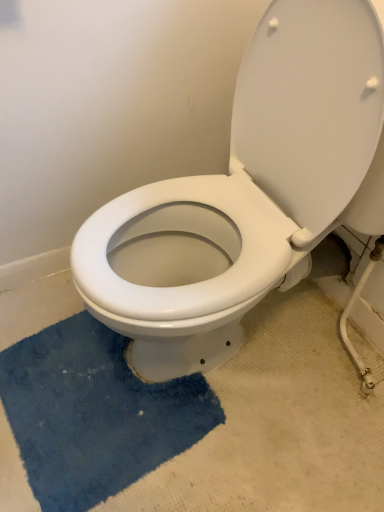
You are a GUI agent. You are given a task and a screenshot of the screen. Output one action in this format:
    pyautogui.click(x=<x>, y=<y>)
    Task: Click on the white glossy toilet at center
    The image size is (384, 512).
    Given the screenshot: What is the action you would take?
    click(x=247, y=194)

What do you see at coordinates (247, 194) in the screenshot? I see `white glossy toilet at center` at bounding box center [247, 194].

Locate an element on the screen. blue plush bath mat at lower left is located at coordinates (94, 413).

Measure the distance between point [104,416] and camera.

Point [104,416] is 1.02 meters from camera.

What do you see at coordinates (94, 413) in the screenshot?
I see `blue plush bath mat at lower left` at bounding box center [94, 413].

At what (x,y) coordinates should I click in order to perform the action: click on white glossy toilet at center. Please return your answer as a coordinate pair (x, y). Looking at the image, I should click on [x=247, y=194].

Which object is positioned more to the right, blue plush bath mat at lower left or white glossy toilet at center?

From the viewer's perspective, white glossy toilet at center appears more on the right side.

Is blue plush bath mat at lower left further to camera compared to white glossy toilet at center?

That is True.

Considering the positions of points (85, 422) and (121, 234), is point (85, 422) closer to camera compared to point (121, 234)?

That is False.

From the image's perspective, which is below, blue plush bath mat at lower left or white glossy toilet at center?

blue plush bath mat at lower left appears lower in the image.

From a real-world perspective, is blue plush bath mat at lower left above or below white glossy toilet at center?

In terms of real-world spatial position, blue plush bath mat at lower left is below white glossy toilet at center.

Considering the sizes of objects blue plush bath mat at lower left and white glossy toilet at center in the image provided, who is wider, blue plush bath mat at lower left or white glossy toilet at center?

With larger width is white glossy toilet at center.

Based on the photo, considering the relative sizes of blue plush bath mat at lower left and white glossy toilet at center in the image provided, is blue plush bath mat at lower left taller than white glossy toilet at center?

In fact, blue plush bath mat at lower left may be shorter than white glossy toilet at center.

Looking at the image, does blue plush bath mat at lower left seem bigger or smaller compared to white glossy toilet at center?

Considering their sizes, blue plush bath mat at lower left takes up less space than white glossy toilet at center.

From the picture: Would you say blue plush bath mat at lower left is outside white glossy toilet at center?

Yes, blue plush bath mat at lower left is outside of white glossy toilet at center.

Is blue plush bath mat at lower left next to white glossy toilet at center?

No, blue plush bath mat at lower left is not touching white glossy toilet at center.

Could you tell me if blue plush bath mat at lower left is facing white glossy toilet at center?

No, blue plush bath mat at lower left is not oriented towards white glossy toilet at center.

How many degrees apart are the facing directions of blue plush bath mat at lower left and white glossy toilet at center?

blue plush bath mat at lower left and white glossy toilet at center are facing 6.98 degrees away from each other.

Where is `toilet above the blue plush bath mat at lower left (from a real-world perspective)`? toilet above the blue plush bath mat at lower left (from a real-world perspective) is located at coordinates (247, 194).

Considering the relative positions of white glossy toilet at center and blue plush bath mat at lower left in the image provided, is white glossy toilet at center to the left of blue plush bath mat at lower left from the viewer's perspective?

Incorrect, white glossy toilet at center is not on the left side of blue plush bath mat at lower left.

Which object is closer to the camera taking this photo, white glossy toilet at center or blue plush bath mat at lower left?

Positioned in front is white glossy toilet at center.

Is point (305, 178) positioned in front of point (96, 378)?

Yes, it is in front of point (96, 378).

From the image's perspective, would you say white glossy toilet at center is positioned over blue plush bath mat at lower left?

Yes, from the image's perspective, white glossy toilet at center is over blue plush bath mat at lower left.

From a real-world perspective, is white glossy toilet at center physically below blue plush bath mat at lower left?

Incorrect, from a real-world perspective, white glossy toilet at center is higher than blue plush bath mat at lower left.

Considering the sizes of objects white glossy toilet at center and blue plush bath mat at lower left in the image provided, who is wider, white glossy toilet at center or blue plush bath mat at lower left?

Wider between the two is white glossy toilet at center.

Which of these two, white glossy toilet at center or blue plush bath mat at lower left, stands taller?

Standing taller between the two is white glossy toilet at center.

Is white glossy toilet at center bigger than blue plush bath mat at lower left?

Correct, white glossy toilet at center is larger in size than blue plush bath mat at lower left.

Is white glossy toilet at center completely or partially outside of blue plush bath mat at lower left?

Yes, white glossy toilet at center is not within blue plush bath mat at lower left.

Are white glossy toilet at center and blue plush bath mat at lower left far apart?

No, white glossy toilet at center is not far away from blue plush bath mat at lower left.

Is white glossy toilet at center looking in the opposite direction of blue plush bath mat at lower left?

No, blue plush bath mat at lower left is not at the back of white glossy toilet at center.

Locate an element on the screen. toilet on the right of the blue plush bath mat at lower left is located at coordinates (247, 194).

This screenshot has height=512, width=384. Find the location of `bath mat on the left side of white glossy toilet at center`. bath mat on the left side of white glossy toilet at center is located at coordinates (94, 413).

Where is `toilet located in front of the blue plush bath mat at lower left`? This screenshot has width=384, height=512. toilet located in front of the blue plush bath mat at lower left is located at coordinates (247, 194).